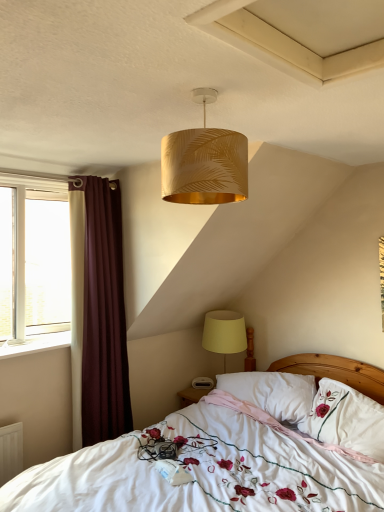
Question: Are white soft pillow at center, the 2th pillow in the right-to-left sequence, and gold leaf-patterned lampshade at upper center, marked as the first lamp in a front-to-back arrangement, beside each other?

Choices:
 (A) yes
 (B) no

Answer: (B)

Question: Considering the relative sizes of white soft pillow at center, the 2th pillow in the right-to-left sequence, and gold leaf-patterned lampshade at upper center, acting as the first lamp starting from the top, in the image provided, is white soft pillow at center, the 2th pillow in the right-to-left sequence, shorter than gold leaf-patterned lampshade at upper center, acting as the first lamp starting from the top,?

Choices:
 (A) yes
 (B) no

Answer: (A)

Question: Is white soft pillow at center, which is the first pillow from left to right, looking in the opposite direction of gold leaf-patterned lampshade at upper center, marked as the 2th lamp in a back-to-front arrangement?

Choices:
 (A) yes
 (B) no

Answer: (B)

Question: Is white soft pillow at center, the 2th pillow in the right-to-left sequence, in front of gold leaf-patterned lampshade at upper center, marked as the 2th lamp in a back-to-front arrangement?

Choices:
 (A) no
 (B) yes

Answer: (A)

Question: From a real-world perspective, is white soft pillow at center, the 2th pillow in the right-to-left sequence, positioned over gold leaf-patterned lampshade at upper center, marked as the first lamp in a front-to-back arrangement, based on gravity?

Choices:
 (A) yes
 (B) no

Answer: (B)

Question: Considering the positions of white plastic window sill at left and yellow fabric lampshade at lower right, which is counted as the first lamp, starting from the back, in the image, is white plastic window sill at left bigger or smaller than yellow fabric lampshade at lower right, which is counted as the first lamp, starting from the back,?

Choices:
 (A) big
 (B) small

Answer: (B)

Question: From the image's perspective, is white plastic window sill at left positioned above or below yellow fabric lampshade at lower right, acting as the 2th lamp starting from the front?

Choices:
 (A) below
 (B) above

Answer: (B)

Question: Is white plastic window sill at left wider or thinner than yellow fabric lampshade at lower right, which is counted as the first lamp, starting from the back?

Choices:
 (A) thin
 (B) wide

Answer: (A)

Question: From their relative heights in the image, would you say white plastic window sill at left is taller or shorter than yellow fabric lampshade at lower right, which is counted as the first lamp, starting from the back?

Choices:
 (A) short
 (B) tall

Answer: (A)

Question: Which is correct: gold leaf-patterned lampshade at upper center, which is counted as the second lamp, starting from the bottom, is inside white soft pillow at center, which is the first pillow from left to right, or outside of it?

Choices:
 (A) inside
 (B) outside

Answer: (B)

Question: In the image, is gold leaf-patterned lampshade at upper center, marked as the first lamp in a front-to-back arrangement, on the left side or the right side of white soft pillow at center, the 2th pillow in the right-to-left sequence?

Choices:
 (A) right
 (B) left

Answer: (B)

Question: Does point (228, 145) appear closer or farther from the camera than point (269, 404)?

Choices:
 (A) farther
 (B) closer

Answer: (B)

Question: From the image's perspective, is gold leaf-patterned lampshade at upper center, acting as the first lamp starting from the top, positioned above or below white soft pillow at center, the 2th pillow in the right-to-left sequence?

Choices:
 (A) above
 (B) below

Answer: (A)

Question: Is point (299, 394) closer or farther from the camera than point (109, 220)?

Choices:
 (A) closer
 (B) farther

Answer: (A)

Question: Considering the positions of white soft pillow at center, the 2th pillow in the right-to-left sequence, and burgundy fabric curtain at left in the image, is white soft pillow at center, the 2th pillow in the right-to-left sequence, taller or shorter than burgundy fabric curtain at left?

Choices:
 (A) tall
 (B) short

Answer: (B)